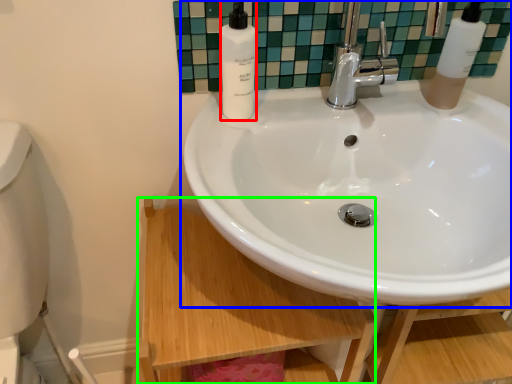
Question: Which is nearer to the soap dispenser (highlighted by a red box)? sink (highlighted by a blue box) or counter top (highlighted by a green box).

Choices:
 (A) sink
 (B) counter top

Answer: (A)